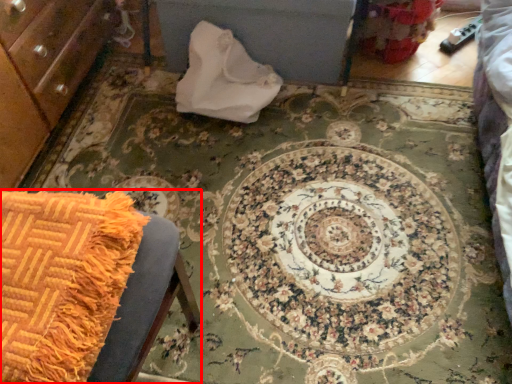
Question: Where is furniture (annotated by the red box) located in relation to material in the image?

Choices:
 (A) right
 (B) left

Answer: (B)